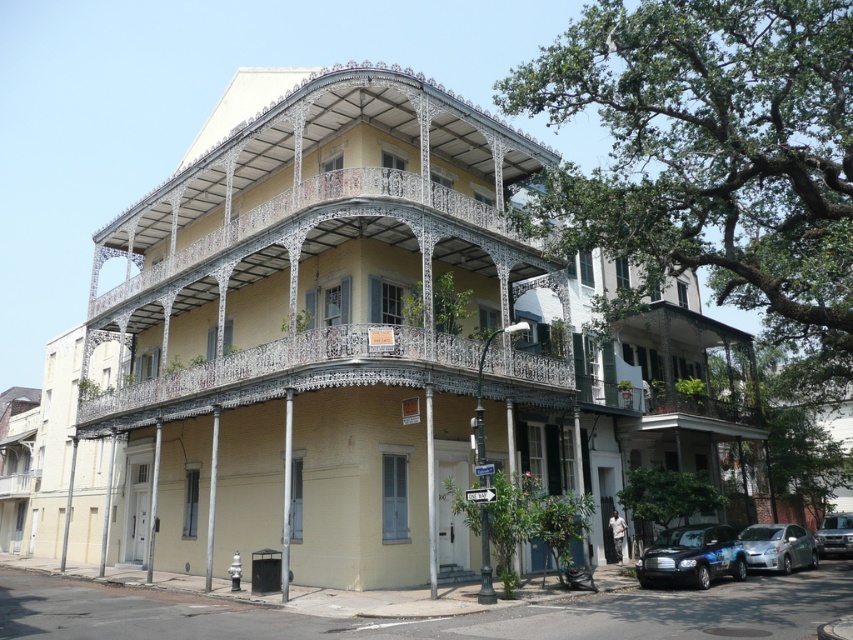
Between white wrought iron balcony at center and metallic silver suv at lower right, which one appears on the right side from the viewer's perspective?

Positioned to the right is metallic silver suv at lower right.

Does white wrought iron balcony at center appear on the right side of metallic silver suv at lower right?

No, white wrought iron balcony at center is not to the right of metallic silver suv at lower right.

Measure the distance between point (115, 305) and camera.

27.43 meters

You are a GUI agent. You are given a task and a screenshot of the screen. Output one action in this format:
    pyautogui.click(x=<x>, y=<y>)
    Task: Click on the white wrought iron balcony at center
    Image resolution: width=853 pixels, height=640 pixels.
    Given the screenshot: What is the action you would take?
    pyautogui.click(x=312, y=250)

Is shiny blue car at lower right closer to camera compared to metallic silver suv at lower right?

Yes, it is.

Which is in front, point (718, 568) or point (822, 529)?

Positioned in front is point (718, 568).

Image resolution: width=853 pixels, height=640 pixels. I want to click on shiny blue car at lower right, so click(692, 556).

Based on the photo, does white wrought iron balcony at center have a smaller size compared to satin silver car at lower right?

Incorrect, white wrought iron balcony at center is not smaller in size than satin silver car at lower right.

Who is more forward, (268,188) or (758,528)?

Point (758,528) is more forward.

Find the location of `white wrought iron balcony at center`. white wrought iron balcony at center is located at coordinates (312, 250).